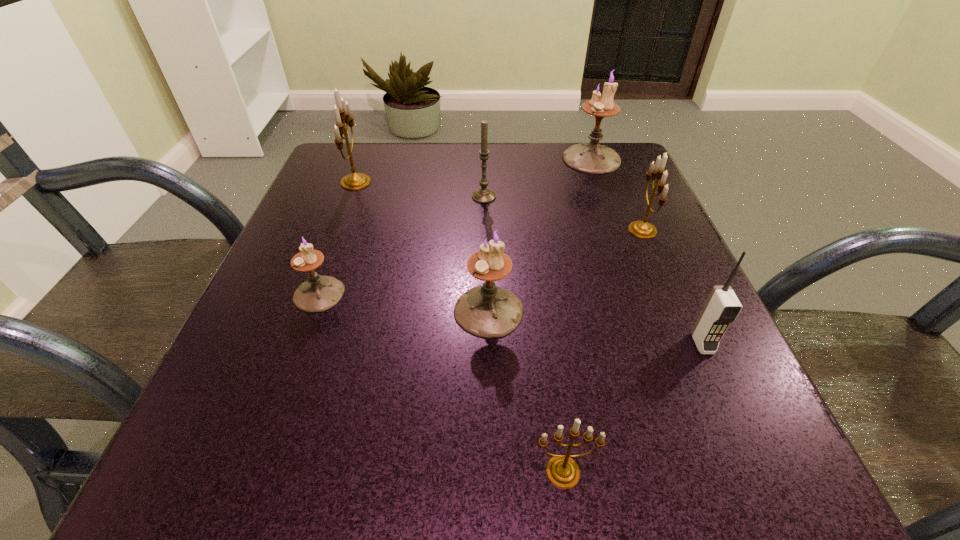
This screenshot has height=540, width=960. In order to click on candle present at the far edge in this screenshot , I will do `click(483, 195)`.

This screenshot has width=960, height=540. Find the location of `object at the near edge`. object at the near edge is located at coordinates (562, 471).

Find the location of a particular element. The image size is (960, 540). cellular telephone at the right edge is located at coordinates (722, 307).

Find the location of a particular element. Image resolution: width=960 pixels, height=540 pixels. object at the far left corner is located at coordinates [x=355, y=181].

Locate an element on the screen. The width and height of the screenshot is (960, 540). object positioned at the far right corner is located at coordinates (591, 157).

Find the location of a particular element. free space at the far edge of the desktop is located at coordinates (444, 167).

In the image, there is a desktop. Where is `free space at the near edge`? The height and width of the screenshot is (540, 960). free space at the near edge is located at coordinates (614, 462).

You are a GUI agent. You are given a task and a screenshot of the screen. Output one action in this format:
    pyautogui.click(x=<x>, y=<y>)
    Task: Click on the free location at the left edge
    The width and height of the screenshot is (960, 540).
    Given the screenshot: What is the action you would take?
    point(292,386)

Locate an element on the screen. The width and height of the screenshot is (960, 540). vacant space at the right edge is located at coordinates (631, 234).

Locate an element on the screen. free region at the far right corner is located at coordinates (626, 161).